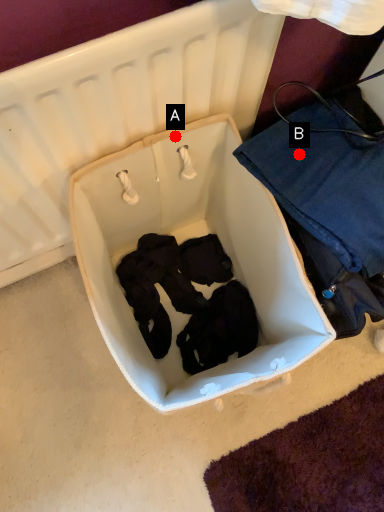
Question: Two points are circled on the image, labeled by A and B beside each circle. Which point appears closest to the camera in this image?

Choices:
 (A) A is closer
 (B) B is closer

Answer: (B)